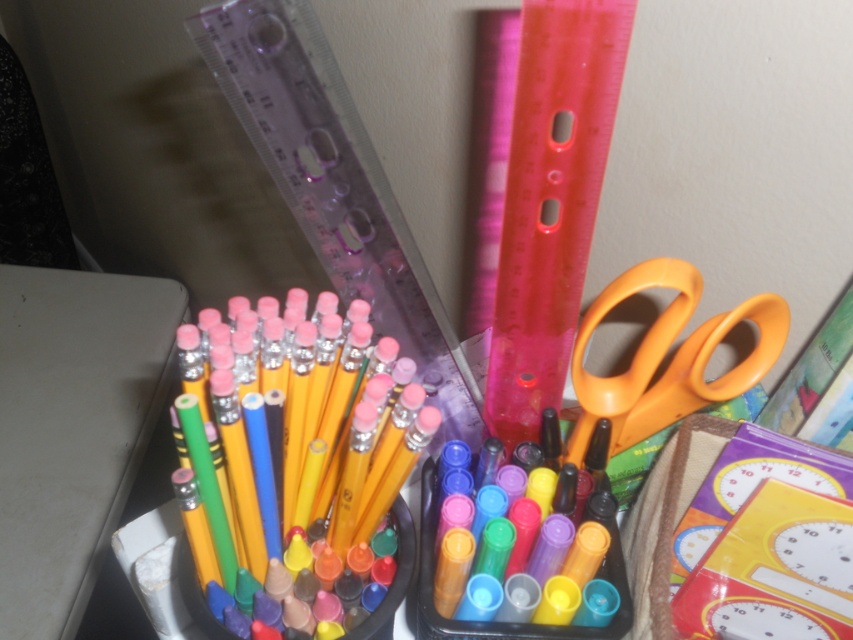
You need to place a small sticker on the tallest object between the orange plastic scissors at right and the translucent plastic markers at center. Which object should you choose?

The orange plastic scissors at right is taller than the translucent plastic markers at center, so you should place the sticker on the orange plastic scissors at right.

In the scene shown: You are organizing school supplies on a desk. You have the yellow matte pencils at center and the translucent plastic markers at center. Which item is positioned closer to you?

The yellow matte pencils at center are closer to the viewer than the translucent plastic markers at center.

You are organizing a desk and notice the yellow matte pencils at center and the translucent plastic markers at center. Which object is taller when placed side by side?

The yellow matte pencils at center are taller than the translucent plastic markers at center.